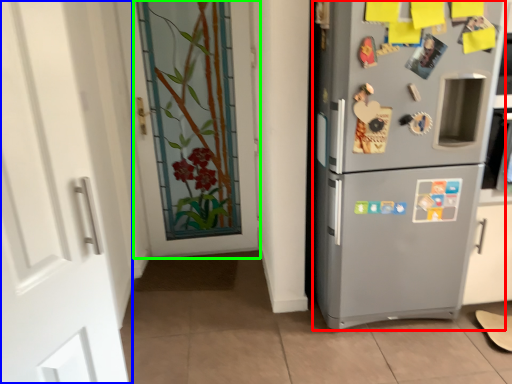
Question: Estimate the real-world distances between objects in this image. Which object is closer to refrigerator (highlighted by a red box), door (highlighted by a blue box) or door (highlighted by a green box)?

Choices:
 (A) door
 (B) door

Answer: (B)